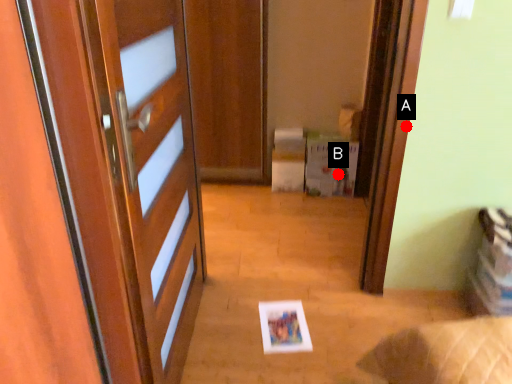
Question: Two points are circled on the image, labeled by A and B beside each circle. Which point is farther from the camera taking this photo?

Choices:
 (A) A is further
 (B) B is further

Answer: (B)